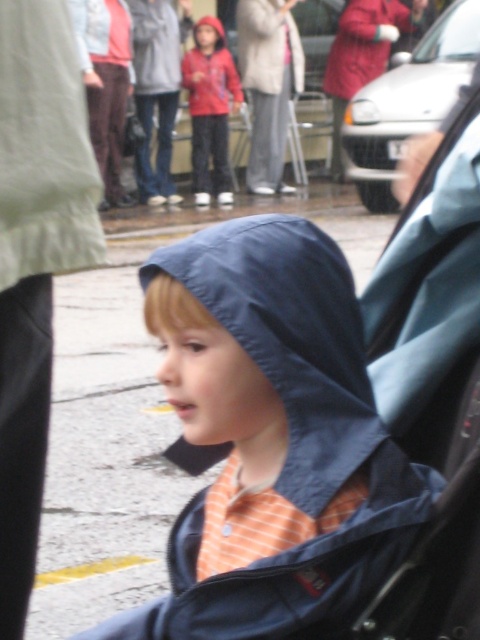
You are a delivery person trying to deliver a package to a child wearing a matte blue jacket at center and a child wearing a red matte jacket at center. According to the scene, which child is wearing the jacket that is positioned lower?

The matte blue jacket at center is below the red matte jacket at center, so the child wearing the matte blue jacket at center is positioned lower.

You are a delivery drone operator. Your drone is currently at coordinates 0.6, 0.5 and needs to deliver a package to the matte blue jacket at center. Which direction should you move the drone to reach the jacket?

The matte blue jacket at center is located at point [273,438], so you should move the drone northeast to reach it.